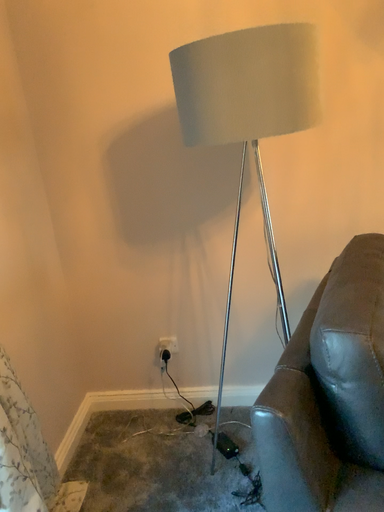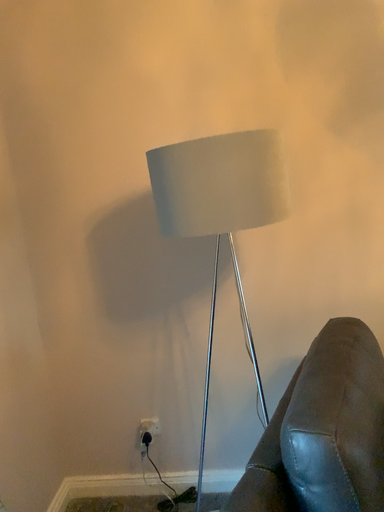
Question: Which way did the camera rotate in the video?

Choices:
 (A) rotated downward
 (B) rotated upward

Answer: (B)